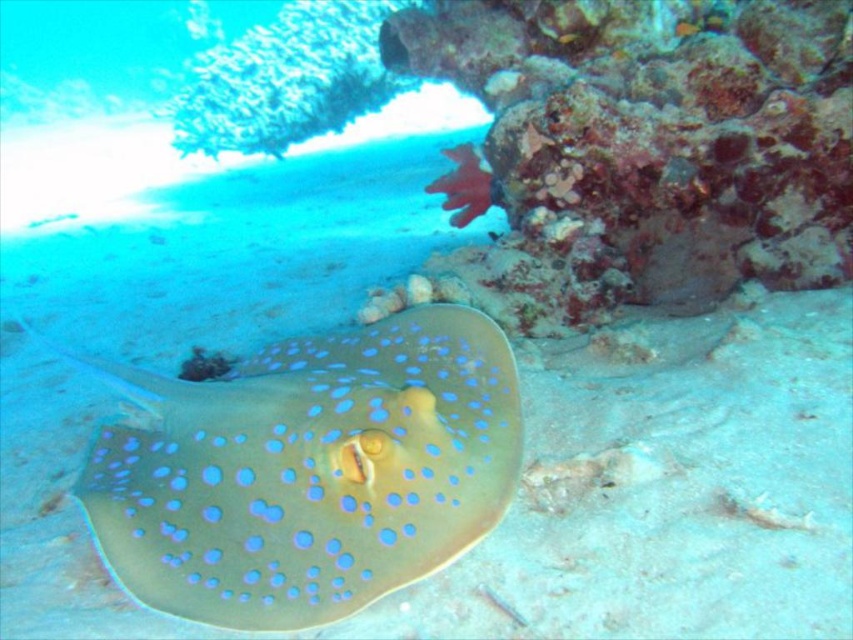
Does rusty coral reef at upper right have a smaller size compared to blue glossy stingray at center?

Actually, rusty coral reef at upper right might be larger than blue glossy stingray at center.

Which is in front, point (795, 109) or point (422, 541)?

Point (422, 541) is in front.

Locate an element on the screen. rusty coral reef at upper right is located at coordinates (643, 147).